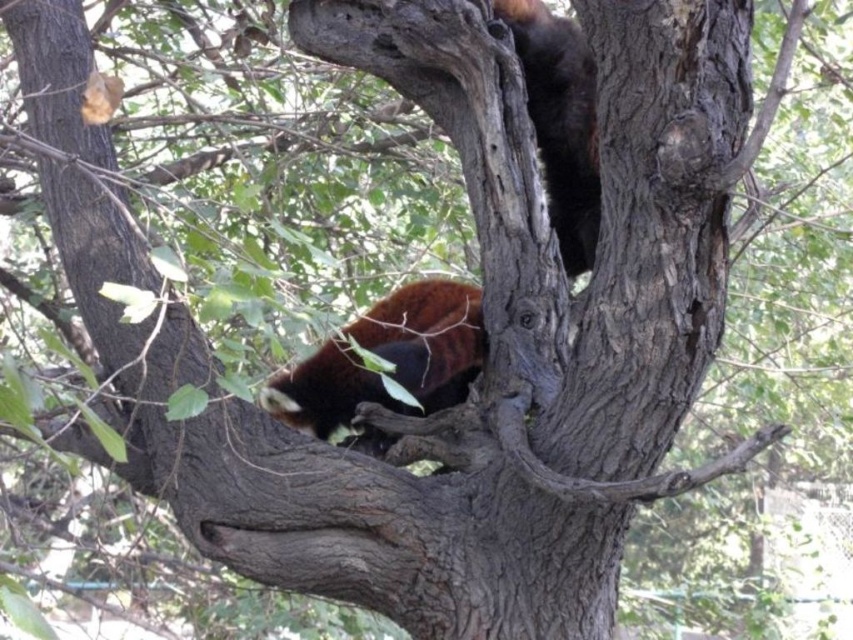
Question: Can you confirm if brown furry animal at center is smaller than fuzzy brown bear at upper right?

Choices:
 (A) no
 (B) yes

Answer: (A)

Question: Which object appears farthest from the camera in this image?

Choices:
 (A) fuzzy brown bear at upper right
 (B) brown furry animal at center

Answer: (A)

Question: Is brown furry animal at center to the right of fuzzy brown bear at upper right from the viewer's perspective?

Choices:
 (A) yes
 (B) no

Answer: (B)

Question: Which of the following is the closest to the observer?

Choices:
 (A) (355, 356)
 (B) (598, 220)

Answer: (A)

Question: Is brown furry animal at center below fuzzy brown bear at upper right?

Choices:
 (A) yes
 (B) no

Answer: (A)